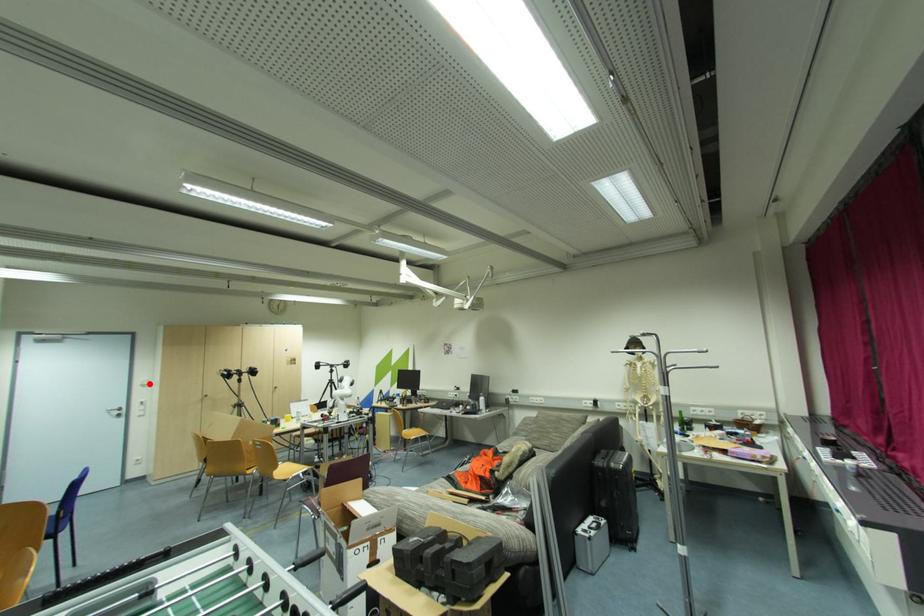
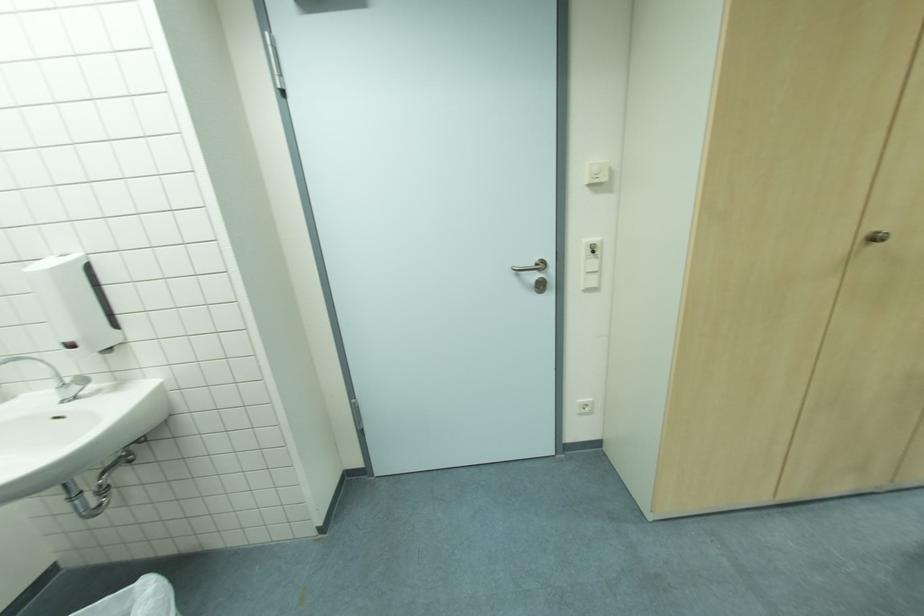
In the second image, find the point that corresponds to the highlighted location in the first image.

(608, 179)